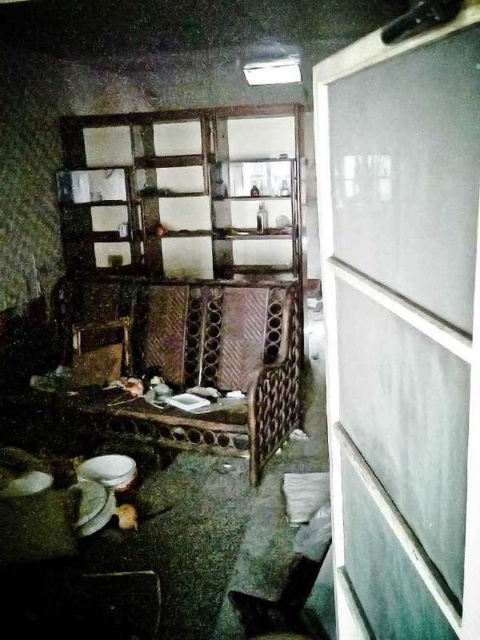
You are a delivery person who needs to place a small package that measures 12 inches in length between the white glossy plate at lower left and the white matte plate at lower left. Is there enough space between them to fit the package?

The distance between the white glossy plate at lower left and the white matte plate at lower left is 10.87 inches. Since the package is 12 inches long, it is longer than the available space, so it won

You are a delivery person who needs to deliver a package to the apartment. You see the clear plastic screen door at right and the white matte plate at lower left. Which object is larger in size?

The clear plastic screen door at right is bigger than the white matte plate at lower left according to the description.

You are a delivery person carrying a large package that is 24 inches wide. You approach the clear plastic screen door at right. Can you fit the package through the door opening without bending or damaging it?

The clear plastic screen door at right is 23.74 inches from camera, which is slightly narrower than the 24 inch package. The package will not fit through the door opening without being adjusted.